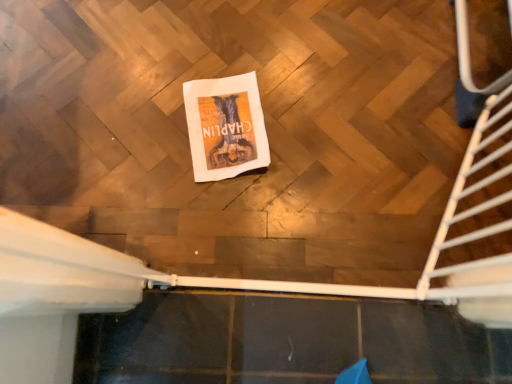
Locate an element on the screen. This screenshot has width=512, height=384. free spot behind white paper towel at center is located at coordinates (228, 46).